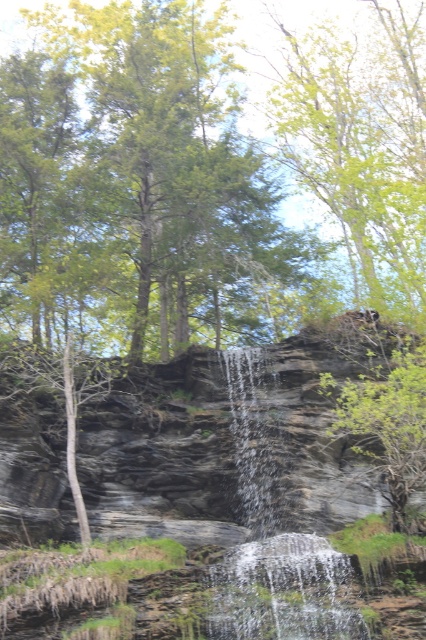
Is translucent glass waterfall at center above clear glass waterfall at center?

Actually, translucent glass waterfall at center is below clear glass waterfall at center.

Who is positioned more to the left, translucent glass waterfall at center or clear glass waterfall at center?

clear glass waterfall at center is more to the left.

Between point (265, 611) and point (232, 408), which one is positioned in front?

Point (265, 611) is in front.

At what (x,y) coordinates should I click in order to perform the action: click on translucent glass waterfall at center. Please return your answer as a coordinate pair (x, y). The image size is (426, 640). Looking at the image, I should click on (282, 592).

Is the position of translucent glass waterfall at center less distant than that of green leafy tree at center?

Yes, translucent glass waterfall at center is in front of green leafy tree at center.

Can you confirm if translucent glass waterfall at center is shorter than green leafy tree at center?

Indeed, translucent glass waterfall at center has a lesser height compared to green leafy tree at center.

At what (x,y) coordinates should I click in order to perform the action: click on translucent glass waterfall at center. Please return your answer as a coordinate pair (x, y). The height and width of the screenshot is (640, 426). Looking at the image, I should click on (282, 592).

In order to click on translucent glass waterfall at center in this screenshot , I will do `click(282, 592)`.

Between point (377, 435) and point (258, 432), which one is positioned in front?

Point (377, 435) is more forward.

Which is behind, point (397, 486) or point (238, 401)?

The point (238, 401) is more distant.

The height and width of the screenshot is (640, 426). I want to click on green leafy tree at center, so (x=386, y=424).